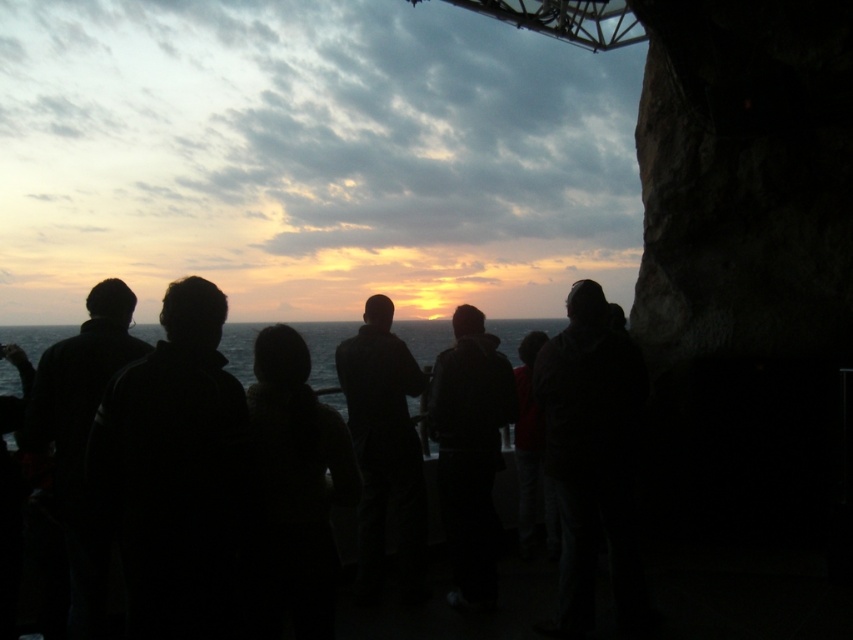
Question: Can you confirm if black matte people at center is positioned to the right of olive green water at center?

Choices:
 (A) no
 (B) yes

Answer: (B)

Question: Is black matte people at center to the right of olive green water at center from the viewer's perspective?

Choices:
 (A) no
 (B) yes

Answer: (B)

Question: Does black matte people at center have a larger size compared to olive green water at center?

Choices:
 (A) yes
 (B) no

Answer: (B)

Question: Which point is farther to the camera?

Choices:
 (A) olive green water at center
 (B) black matte people at center

Answer: (A)

Question: Among these objects, which one is nearest to the camera?

Choices:
 (A) olive green water at center
 (B) black matte people at center

Answer: (B)